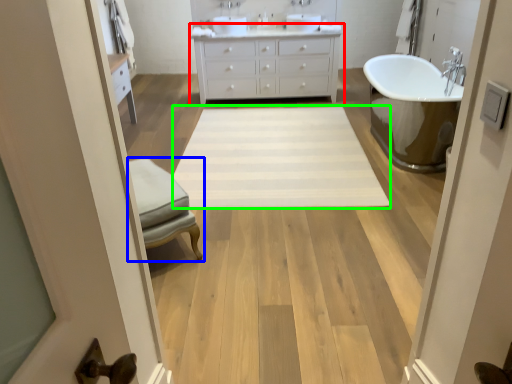
Question: Which object is positioned closest to bathroom cabinet (highlighted by a red box)? Select from furniture (highlighted by a blue box) and plain (highlighted by a green box).

Choices:
 (A) furniture
 (B) plain

Answer: (B)